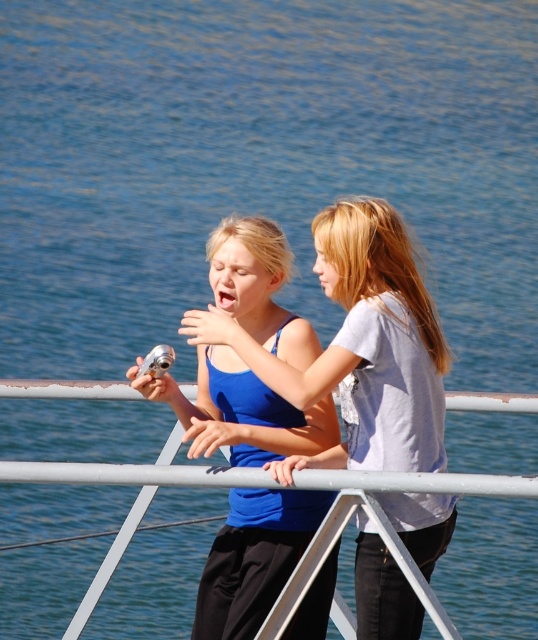
Based on the photo, you are a photographer trying to capture a photo of two girls standing near a railing. You notice two specific points in the scene at coordinates point (160, 385) and point (133, 472). Which point is closer to the camera?

Point (160, 385) is further to the camera than point (133, 472). Therefore, point (133, 472) is closer to the camera.

Based on the photo, you are a photographer trying to capture a candid shot of two girls near a railing. You notice the blue matte tank top at center and the matte blue tank top at center. How much distance should you maintain between your camera and the girls to ensure both are in frame?

The blue matte tank top at center and the matte blue tank top at center are 4.77 feet apart. To ensure both are in frame, your camera should be positioned at least 4.77 feet away from the closer girl to accommodate the distance between them.

You are a photographer trying to capture a wide shot of the two girls and the railing. Given that the blue matte tank top at center is narrower than the metallic gray rail at center, will the tank top fit entirely within the camera frame if the rail is already filling the frame horizontally?

The blue matte tank top at center has a lesser width compared to the metallic gray rail at center. Since the rail is already filling the frame horizontally, the tank top, being narrower, should fit entirely within the frame.